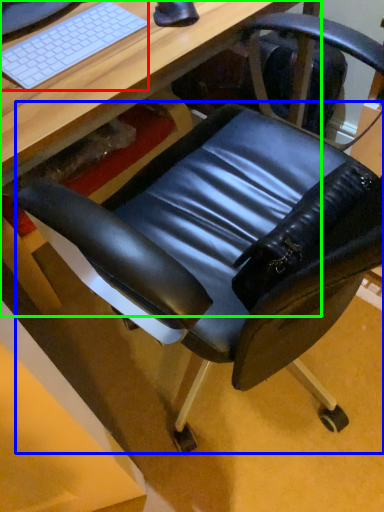
Question: Which is nearer to the computer keyboard (highlighted by a red box)? swivel chair (highlighted by a blue box) or desk (highlighted by a green box).

Choices:
 (A) swivel chair
 (B) desk

Answer: (B)